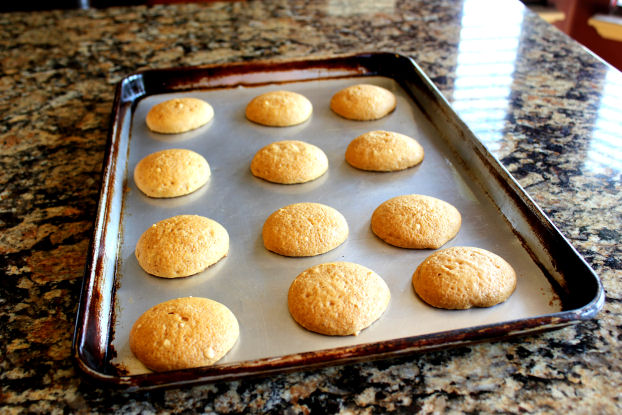
Image resolution: width=622 pixels, height=415 pixels. I want to click on lower left corner of counter, so click(x=9, y=404).